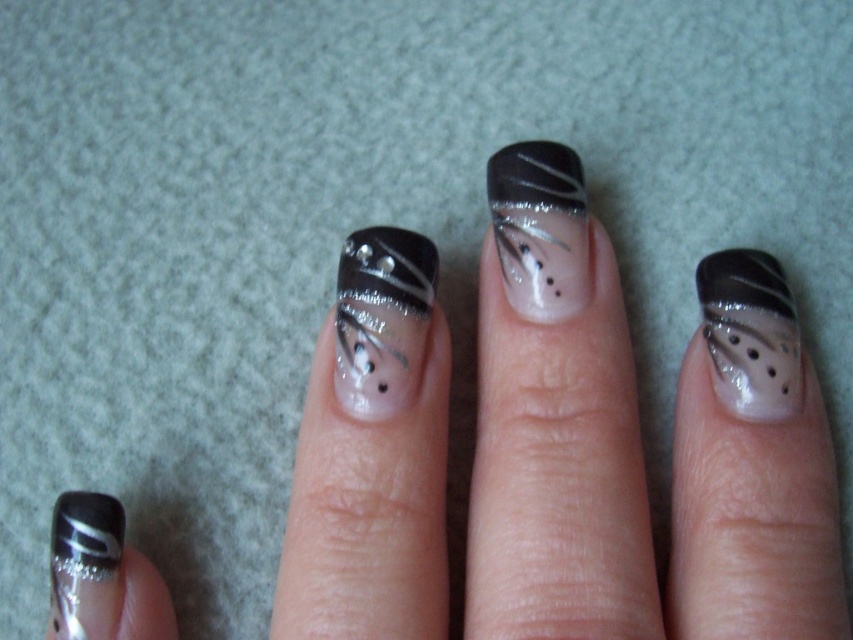
Question: Can you confirm if satin black nail at center is positioned above satin silver nail at center?

Choices:
 (A) yes
 (B) no

Answer: (B)

Question: Which point is closer to the camera?

Choices:
 (A) satin silver nail at center
 (B) matte black nail art at center

Answer: (A)

Question: Which point is closer to the camera?

Choices:
 (A) (61, 616)
 (B) (712, 252)
 (C) (576, 195)

Answer: (A)

Question: Is satin black nail at center below matte black nail art at center?

Choices:
 (A) yes
 (B) no

Answer: (A)

Question: Which object is farther from the camera taking this photo?

Choices:
 (A) matte silver nail at lower left
 (B) satin black nail at center
 (C) matte black nail art at center
 (D) satin silver nail at center

Answer: (C)

Question: Considering the relative positions of matte black nail art at center and matte silver nail at lower left in the image provided, where is matte black nail art at center located with respect to matte silver nail at lower left?

Choices:
 (A) below
 (B) above

Answer: (B)